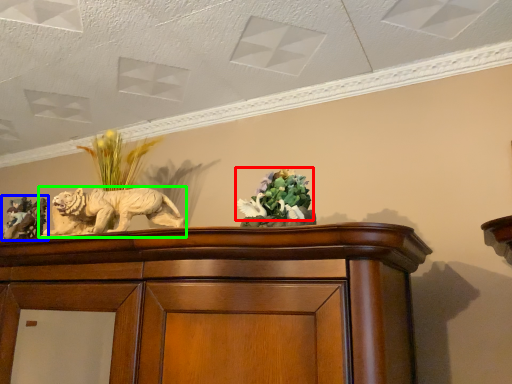
Question: Based on their relative distances, which object is nearer to flower (highlighted by a red box)? Choose from sculpture (highlighted by a blue box) and lion (highlighted by a green box).

Choices:
 (A) sculpture
 (B) lion

Answer: (B)